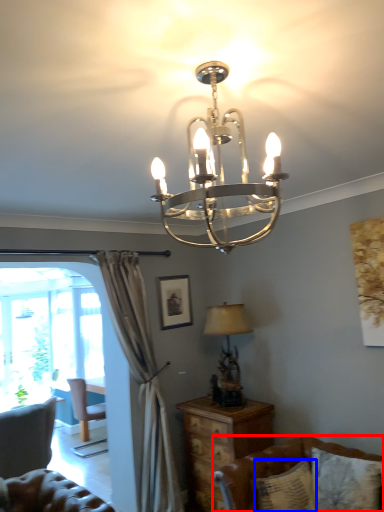
Question: Which object is closer to the camera taking this photo, studio couch (highlighted by a red box) or pillow (highlighted by a blue box)?

Choices:
 (A) studio couch
 (B) pillow

Answer: (A)